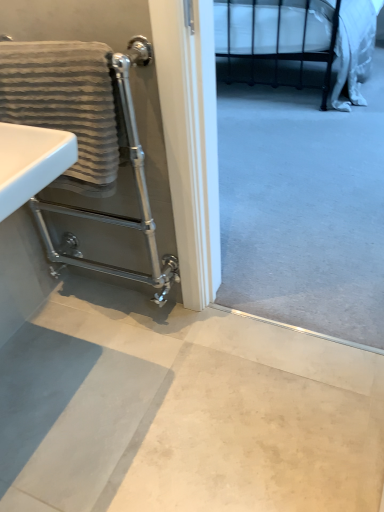
Looking at this image, measure the distance between point (184, 138) and camera.

Point (184, 138) is 3.72 feet from camera.

This screenshot has height=512, width=384. I want to click on smooth concrete floor at lower center, so click(x=205, y=415).

The image size is (384, 512). Describe the element at coordinates (65, 104) in the screenshot. I see `gray textured towel at left` at that location.

At what (x,y) coordinates should I click in order to perform the action: click on black metal bed at upper right. Please return your answer as a coordinate pair (x, y). Looking at the image, I should click on (273, 28).

Where is `bed that appears behind the gray textured towel at left`? This screenshot has height=512, width=384. bed that appears behind the gray textured towel at left is located at coordinates pos(273,28).

Is gray textured towel at left not close to black metal bed at upper right?

gray textured towel at left is far away from black metal bed at upper right.

From the image's perspective, is gray textured towel at left below black metal bed at upper right?

Yes.

Is point (93, 88) positioned before point (244, 25)?

That is True.

Is silver metallic towel rack at left facing away from smooth concrete floor at lower center?

No.

From the image's perspective, is silver metallic towel rack at left located above smooth concrete floor at lower center?

Yes, from the image's perspective, silver metallic towel rack at left is over smooth concrete floor at lower center.

Would you say smooth concrete floor at lower center is part of silver metallic towel rack at left's contents?

No, smooth concrete floor at lower center is not a part of silver metallic towel rack at left.

Can you confirm if silver metallic towel rack at left is thinner than smooth concrete floor at lower center?

Indeed, silver metallic towel rack at left has a lesser width compared to smooth concrete floor at lower center.

From a real-world perspective, relative to silver metallic towel rack at left, is black metal bed at upper right vertically above or below?

black metal bed at upper right is situated lower than silver metallic towel rack at left in the real world.

Is point (319, 58) more distant than point (181, 5)?

Yes, point (319, 58) is behind point (181, 5).

Considering the relative sizes of black metal bed at upper right and silver metallic towel rack at left in the image provided, is black metal bed at upper right smaller than silver metallic towel rack at left?

Actually, black metal bed at upper right might be larger than silver metallic towel rack at left.

Identify the location of bed on the right of silver metallic towel rack at left. (273, 28).

Considering the sizes of objects smooth concrete floor at lower center and silver metallic towel rack at left in the image provided, who is shorter, smooth concrete floor at lower center or silver metallic towel rack at left?

smooth concrete floor at lower center is shorter.

I want to click on concrete below the silver metallic towel rack at left (from the image's perspective), so click(205, 415).

Considering the sizes of objects smooth concrete floor at lower center and silver metallic towel rack at left in the image provided, who is bigger, smooth concrete floor at lower center or silver metallic towel rack at left?

silver metallic towel rack at left.

Which is behind, smooth concrete floor at lower center or silver metallic towel rack at left?

silver metallic towel rack at left is behind.

Is black metal bed at upper right inside or outside of smooth concrete floor at lower center?

The correct answer is: outside.

Is black metal bed at upper right aimed at smooth concrete floor at lower center?

Yes, black metal bed at upper right faces towards smooth concrete floor at lower center.

Identify the location of bed behind the smooth concrete floor at lower center. This screenshot has height=512, width=384. (273, 28).

Is black metal bed at upper right smaller than smooth concrete floor at lower center?

Incorrect, black metal bed at upper right is not smaller in size than smooth concrete floor at lower center.

Would you say black metal bed at upper right is part of smooth concrete floor at lower center's contents?

Actually, black metal bed at upper right is outside smooth concrete floor at lower center.

Would you say smooth concrete floor at lower center is to the left or to the right of black metal bed at upper right in the picture?

Clearly, smooth concrete floor at lower center is on the left of black metal bed at upper right in the image.

From a real-world perspective, is smooth concrete floor at lower center located beneath black metal bed at upper right?

Yes, from a real-world perspective, smooth concrete floor at lower center is under black metal bed at upper right.

Considering the relative sizes of smooth concrete floor at lower center and black metal bed at upper right in the image provided, is smooth concrete floor at lower center smaller than black metal bed at upper right?

Indeed, smooth concrete floor at lower center has a smaller size compared to black metal bed at upper right.

Which of these two, silver metallic towel rack at left or gray textured towel at left, is wider?

silver metallic towel rack at left is wider.

From the image's perspective, is silver metallic towel rack at left above or below gray textured towel at left?

silver metallic towel rack at left is below gray textured towel at left.

Is silver metallic towel rack at left located outside gray textured towel at left?

Absolutely, silver metallic towel rack at left is external to gray textured towel at left.

Looking at the image, does silver metallic towel rack at left seem bigger or smaller compared to gray textured towel at left?

silver metallic towel rack at left is bigger than gray textured towel at left.

This screenshot has width=384, height=512. I want to click on bed above the gray textured towel at left (from the image's perspective), so click(273, 28).

The image size is (384, 512). I want to click on concrete that is in front of the silver metallic towel rack at left, so click(x=205, y=415).

Which object lies nearer to the anchor point black metal bed at upper right, silver metallic towel rack at left or smooth concrete floor at lower center?

The object closer to black metal bed at upper right is silver metallic towel rack at left.

From the picture: Which object lies nearer to the anchor point gray textured towel at left, smooth concrete floor at lower center or silver metallic towel rack at left?

silver metallic towel rack at left is closer to gray textured towel at left.

Which object lies nearer to the anchor point silver metallic towel rack at left, smooth concrete floor at lower center or black metal bed at upper right?

smooth concrete floor at lower center is closer to silver metallic towel rack at left.

Which object lies further to the anchor point smooth concrete floor at lower center, black metal bed at upper right or silver metallic towel rack at left?

black metal bed at upper right is further to smooth concrete floor at lower center.

Which object lies further to the anchor point gray textured towel at left, black metal bed at upper right or silver metallic towel rack at left?

Based on the image, black metal bed at upper right appears to be further to gray textured towel at left.

Looking at this image, considering their positions, is silver metallic towel rack at left positioned closer to smooth concrete floor at lower center than gray textured towel at left?

The object closer to smooth concrete floor at lower center is silver metallic towel rack at left.

Considering their positions, is gray textured towel at left positioned closer to smooth concrete floor at lower center than black metal bed at upper right?

gray textured towel at left lies closer to smooth concrete floor at lower center than the other object.

Looking at the image, which one is located closer to smooth concrete floor at lower center, gray textured towel at left or silver metallic towel rack at left?

silver metallic towel rack at left.

Where is `screen door between black metal bed at upper right and smooth concrete floor at lower center from top to bottom`? screen door between black metal bed at upper right and smooth concrete floor at lower center from top to bottom is located at coordinates (144, 108).

The image size is (384, 512). What are the coordinates of `bath towel that lies between black metal bed at upper right and silver metallic towel rack at left from top to bottom` in the screenshot? It's located at (65, 104).

The width and height of the screenshot is (384, 512). I want to click on screen door between gray textured towel at left and smooth concrete floor at lower center vertically, so click(x=144, y=108).

Locate an element on the screen. This screenshot has width=384, height=512. bath towel between black metal bed at upper right and smooth concrete floor at lower center from top to bottom is located at coordinates (65, 104).